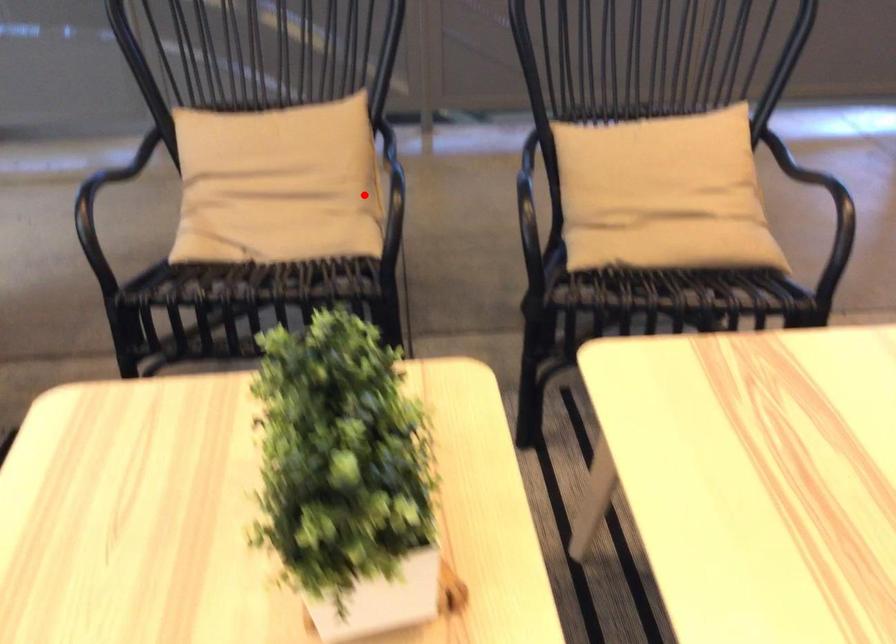
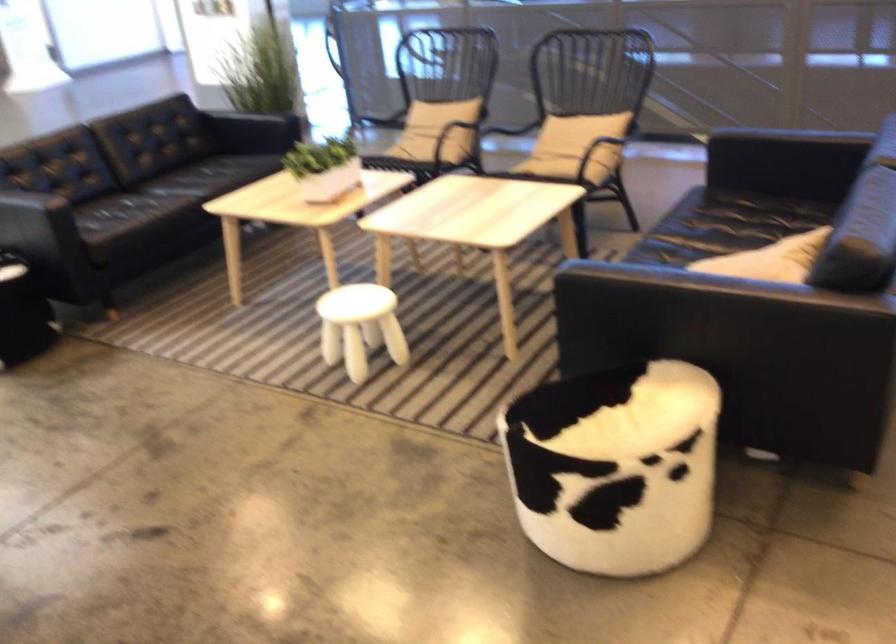
Locate, in the second image, the point that corresponds to the highlighted location in the first image.

(440, 128)